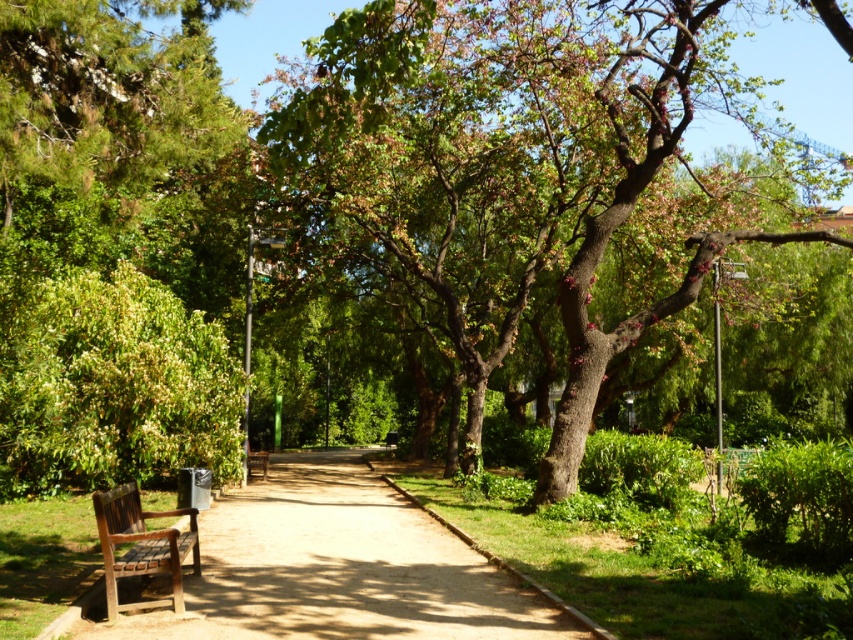
You are standing at the entrance of the park and want to reach the green textured tree at center. Based on the park layout described, what direction should you head to from the entrance to reach the tree?

The green textured tree at center is located at coordinates 0.283 on the x axis and 0.619 on the y axis. Since the entrance is typically at the bottom left corner of the image, you should move northeast to reach the tree.

You are standing in the park and want to take a photo of the green textured tree at center. Your camera has a maximum focus range of 5 meters. Will you need to move closer to the tree to get a clear photo?

The green textured tree at center is 5.28 meters away from viewer, which exceeds the camera maximum focus range of 5 meters. You need to move closer to the tree to get a clear photo.

From the picture: You are a park visitor wanting to walk from the brown wooden pavement at lower left to the wooden bench at lower left. Since the pavement is wider, can you walk along the pavement towards the bench without stepping onto the grass?

The brown wooden pavement at lower left is wider than the wooden bench at lower left, so yes, you can walk along the pavement towards the bench without stepping onto the grass.